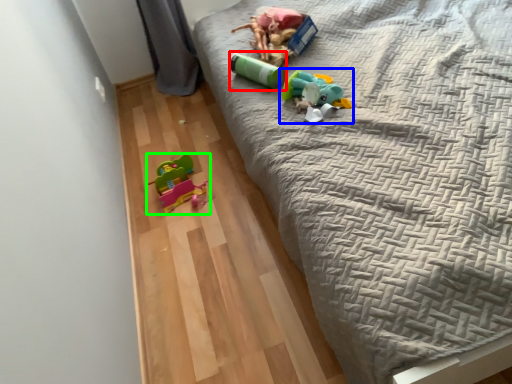
Question: Which object is the farthest from toy (highlighted by a red box)? Choose among these: toy (highlighted by a blue box) or toy (highlighted by a green box).

Choices:
 (A) toy
 (B) toy

Answer: (B)